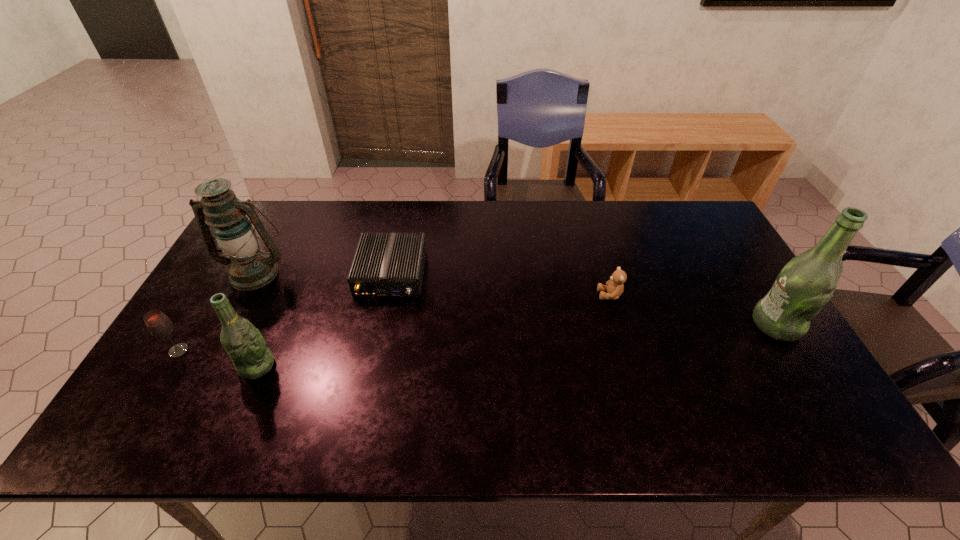
Find the location of `free spot that satisfies the following two spatial constraints: 1. on the back panel of the fourth object from left to right; 2. on the surface of the third tallest object`. free spot that satisfies the following two spatial constraints: 1. on the back panel of the fourth object from left to right; 2. on the surface of the third tallest object is located at coordinates (372, 366).

Where is `free space that satisfies the following two spatial constraints: 1. on the back panel of the shortest object; 2. on the surface of the fourth shortest object`? This screenshot has height=540, width=960. free space that satisfies the following two spatial constraints: 1. on the back panel of the shortest object; 2. on the surface of the fourth shortest object is located at coordinates (372, 366).

The height and width of the screenshot is (540, 960). Find the location of `free space that satisfies the following two spatial constraints: 1. on the back panel of the router; 2. on the surface of the left beer bottle`. free space that satisfies the following two spatial constraints: 1. on the back panel of the router; 2. on the surface of the left beer bottle is located at coordinates (372, 366).